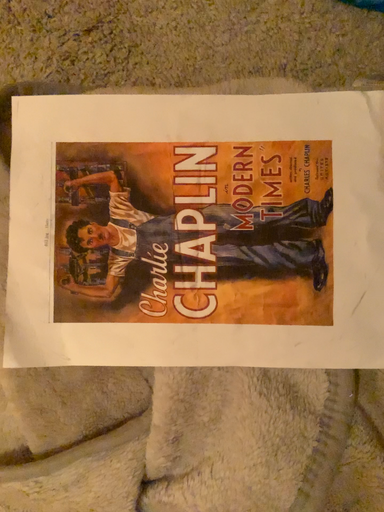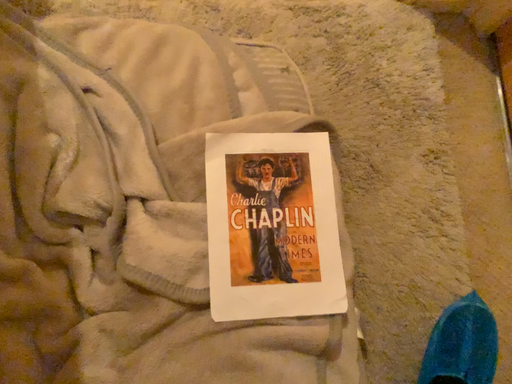
Question: Which way did the camera rotate in the video?

Choices:
 (A) rotated upward
 (B) rotated downward

Answer: (A)